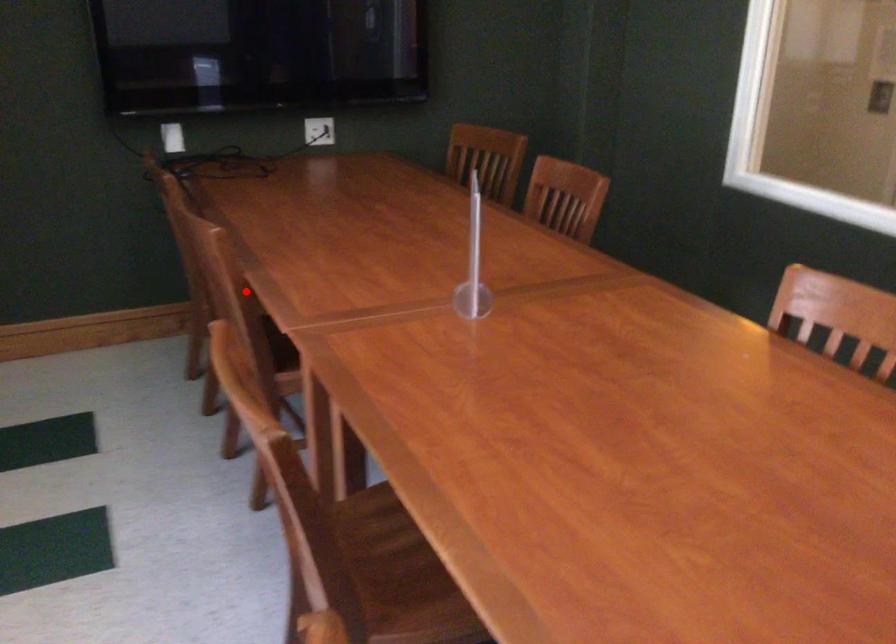
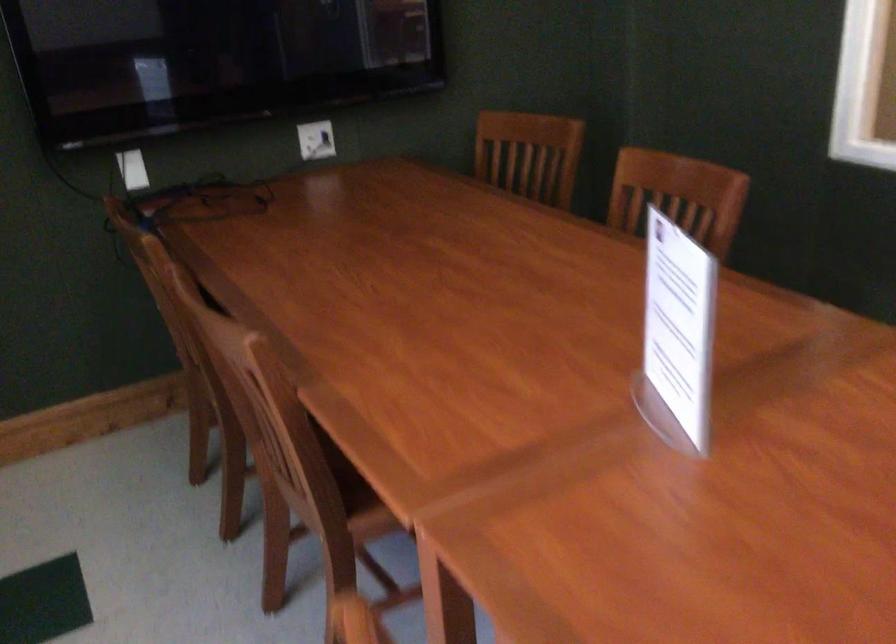
Question: I am providing you with two images of the same scene from different viewpoints. In image1, a red point is highlighted. Considering the same 3D point in image2, which of the following is correct?

Choices:
 (A) It is closer
 (B) It is farther

Answer: (A)